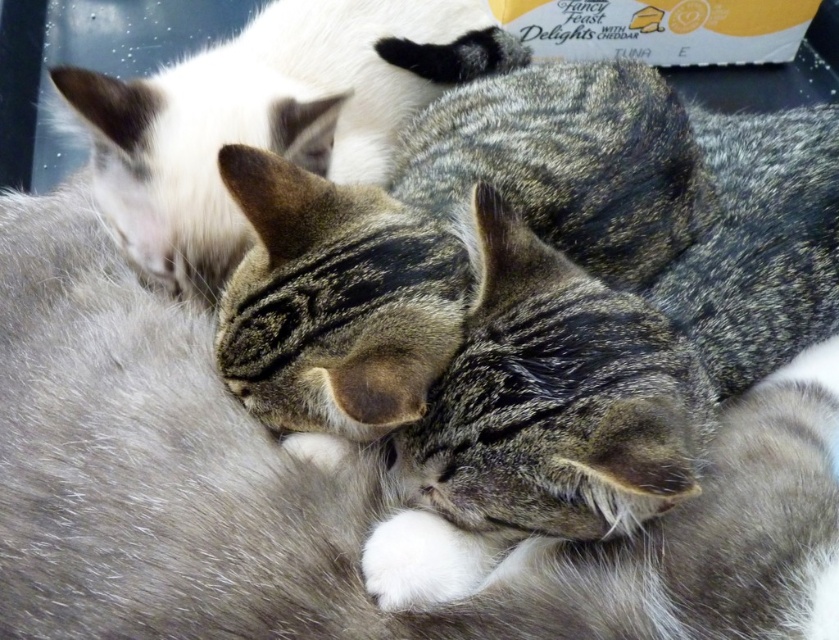
Is tabby fur cat at center shorter than tabby fur cat at upper left?

No, tabby fur cat at center is not shorter than tabby fur cat at upper left.

Based on the photo, does tabby fur cat at center appear under tabby fur cat at upper left?

Yes.

The height and width of the screenshot is (640, 839). I want to click on tabby fur cat at center, so click(444, 225).